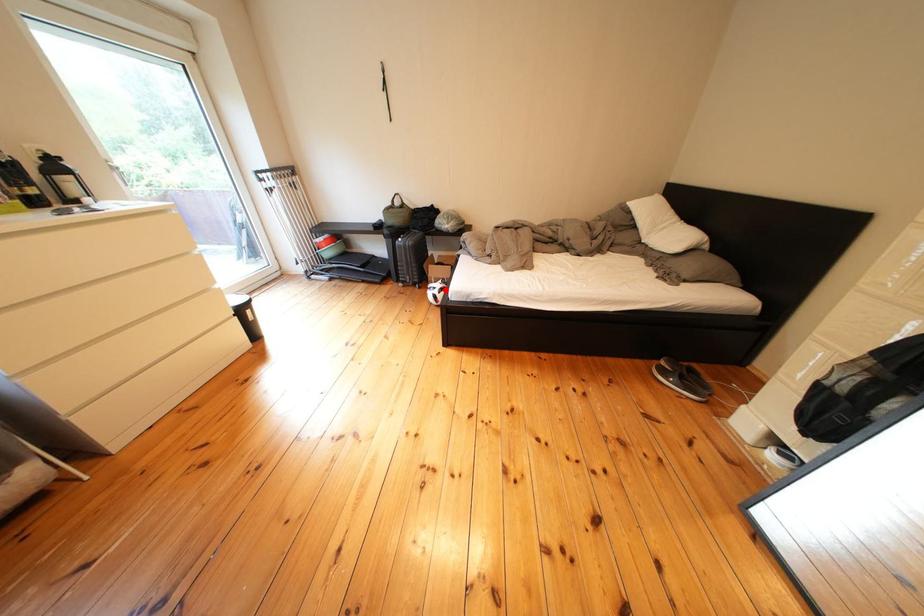
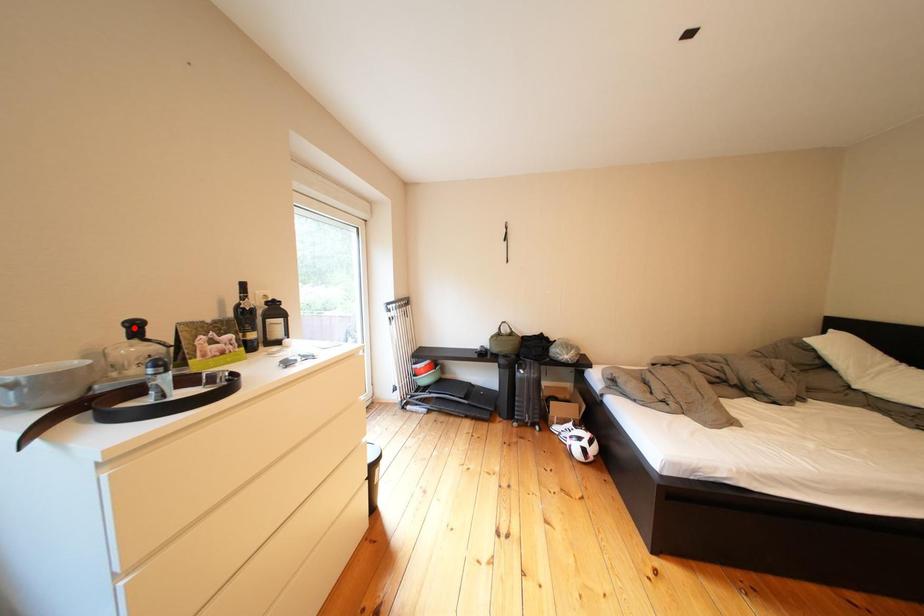
I am providing you with two images of the same scene from different viewpoints. A red point is marked on the first image and another point is marked on the second image. Do the highlighted points in image1 and image2 indicate the same real-world spot?

No